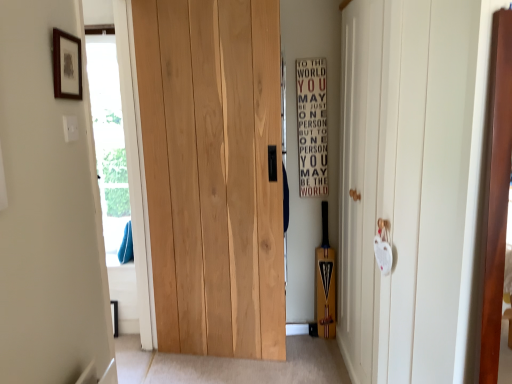
Image resolution: width=512 pixels, height=384 pixels. In order to click on free spot below natural wood door at center, which is the first door in left-to-right order (from a real-world perspective) in this screenshot , I will do `click(218, 361)`.